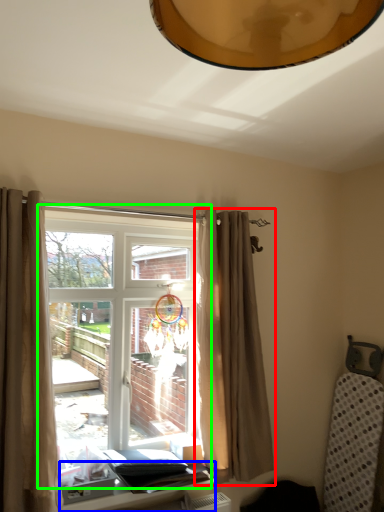
Question: Based on their relative distances, which object is farther from curtain (highlighted by a red box)? Choose from table (highlighted by a blue box) and window (highlighted by a green box).

Choices:
 (A) table
 (B) window

Answer: (A)